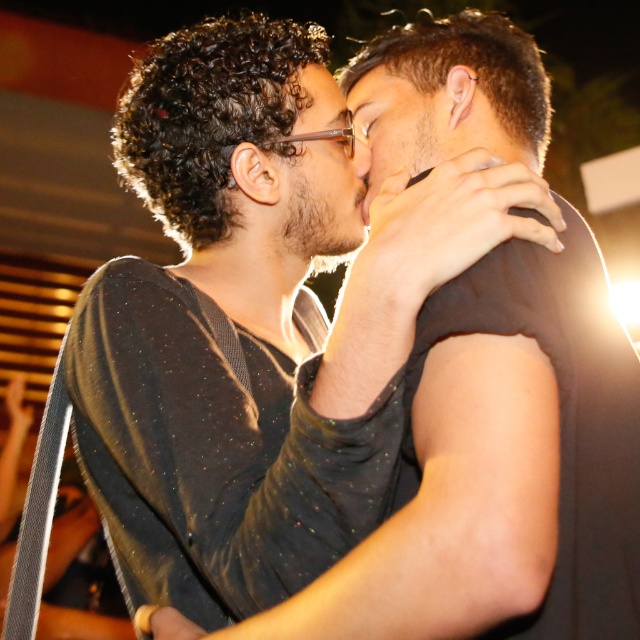
Question: Among these objects, which one is farthest from the camera?

Choices:
 (A) smooth skin face at center
 (B) matte black face at center

Answer: (B)

Question: Is matte black face at center to the left of smooth skin face at center from the viewer's perspective?

Choices:
 (A) no
 (B) yes

Answer: (B)

Question: Among these objects, which one is nearest to the camera?

Choices:
 (A) matte black face at center
 (B) smooth skin face at center

Answer: (B)

Question: Which point appears farthest from the camera in this image?

Choices:
 (A) (317, 125)
 (B) (397, 99)

Answer: (A)

Question: Is matte black face at center further to the viewer compared to smooth skin face at center?

Choices:
 (A) yes
 (B) no

Answer: (A)

Question: Is matte black face at center positioned in front of smooth skin face at center?

Choices:
 (A) no
 (B) yes

Answer: (A)